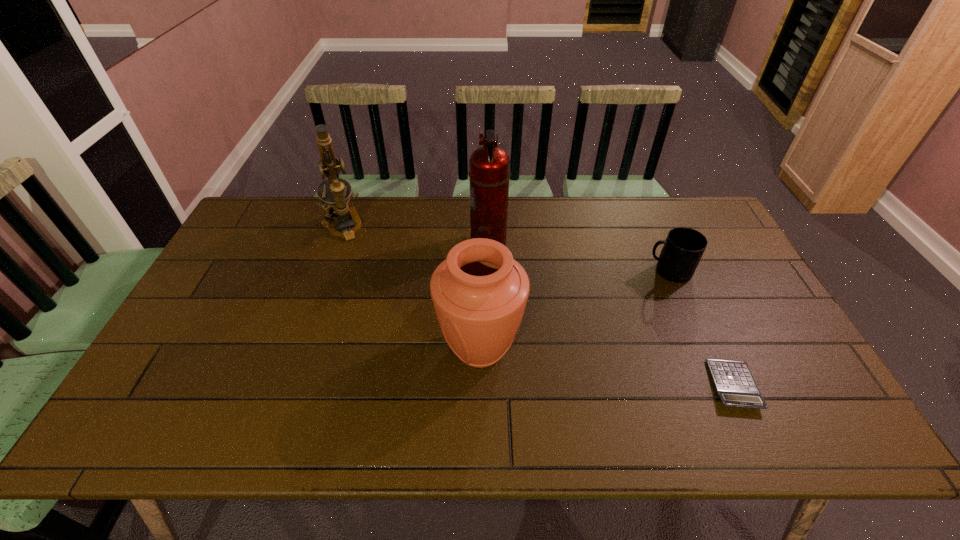
You are a GUI agent. You are given a task and a screenshot of the screen. Output one action in this format:
    pyautogui.click(x=<x>, y=<y>)
    Task: Click on the empty location between the mug and the fire extinguisher
    Image resolution: width=960 pixels, height=540 pixels.
    Given the screenshot: What is the action you would take?
    pyautogui.click(x=578, y=258)

Find the location of a particular element. The height and width of the screenshot is (540, 960). free point between the second shortest object and the vase is located at coordinates (574, 310).

Where is `vacant point located between the leftmost object and the third shortest object`? vacant point located between the leftmost object and the third shortest object is located at coordinates (411, 288).

The image size is (960, 540). In order to click on empty space that is in between the microscope and the shortest object in this screenshot , I will do `click(538, 306)`.

Image resolution: width=960 pixels, height=540 pixels. What are the coordinates of `object that can be found as the fourth closest to the third shortest object` in the screenshot? It's located at (734, 383).

Identify the location of the closest object to the shortest object. This screenshot has height=540, width=960. (683, 248).

Locate an element on the screen. The height and width of the screenshot is (540, 960). vacant space that satisfies the following two spatial constraints: 1. on the side of the fourth tallest object with the handle; 2. on the back side of the shortest object is located at coordinates (717, 386).

Locate an element on the screen. vacant space that satisfies the following two spatial constraints: 1. on the nozzle side of the fire extinguisher; 2. on the right side of the calculator is located at coordinates (492, 386).

At what (x,y) coordinates should I click in order to perform the action: click on free spot that satisfies the following two spatial constraints: 1. on the side of the shortest object with the handle; 2. on the right side of the mug. Please return your answer as a coordinate pair (x, y). The image size is (960, 540). Looking at the image, I should click on (717, 386).

This screenshot has height=540, width=960. I want to click on vacant region that satisfies the following two spatial constraints: 1. on the nozzle side of the fire extinguisher; 2. on the front side of the third tallest object, so point(491,348).